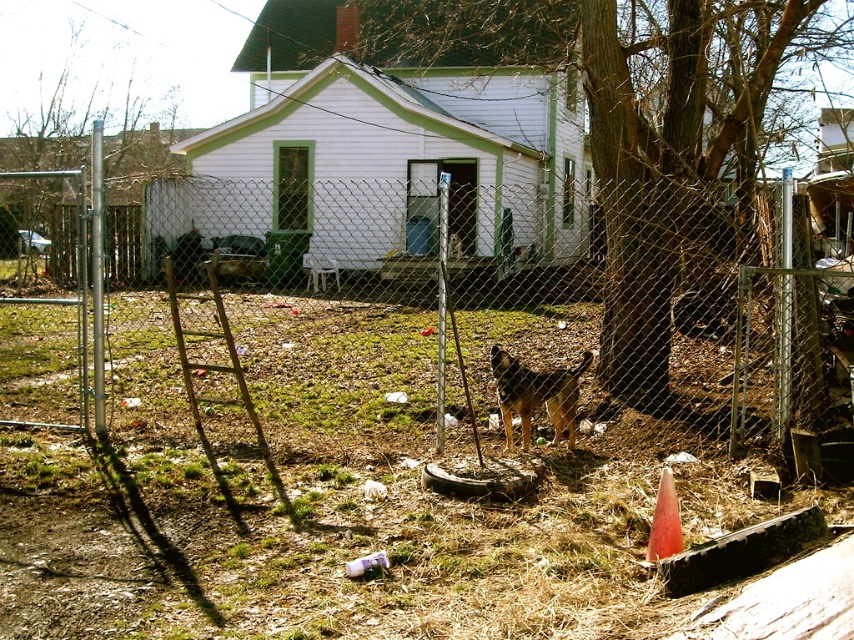
Question: Can you confirm if metal chain-link fence at center is bigger than brown fur dog at center?

Choices:
 (A) yes
 (B) no

Answer: (A)

Question: Observing the image, what is the correct spatial positioning of metal chain-link fence at center in reference to orange matte cone at lower right?

Choices:
 (A) below
 (B) above

Answer: (B)

Question: Which point appears farthest from the camera in this image?

Choices:
 (A) (490, 353)
 (B) (664, 477)

Answer: (A)

Question: Which of the following is the closest to the observer?

Choices:
 (A) (559, 440)
 (B) (652, 556)
 (C) (610, 371)

Answer: (B)

Question: Does metal chain-link fence at center have a lesser width compared to brown fur dog at center?

Choices:
 (A) yes
 (B) no

Answer: (B)

Question: Which point is farther to the camera?

Choices:
 (A) brown fur dog at center
 (B) metal chain-link fence at center

Answer: (A)